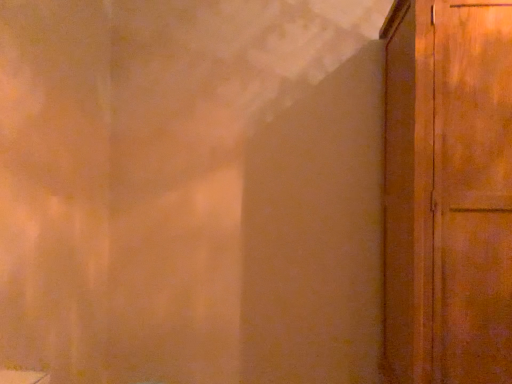
What do you see at coordinates (448, 191) in the screenshot? I see `wooden door at right` at bounding box center [448, 191].

This screenshot has height=384, width=512. Identify the location of wooden door at right. (448, 191).

Find the location of a particular element. This screenshot has width=512, height=384. wooden door at right is located at coordinates (448, 191).